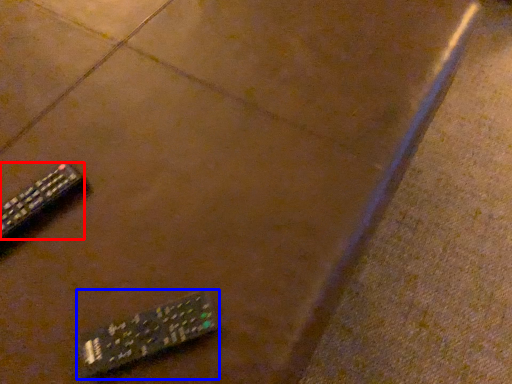
Question: Among these objects, which one is nearest to the camera, remote control (highlighted by a red box) or remote control (highlighted by a blue box)?

Choices:
 (A) remote control
 (B) remote control

Answer: (B)